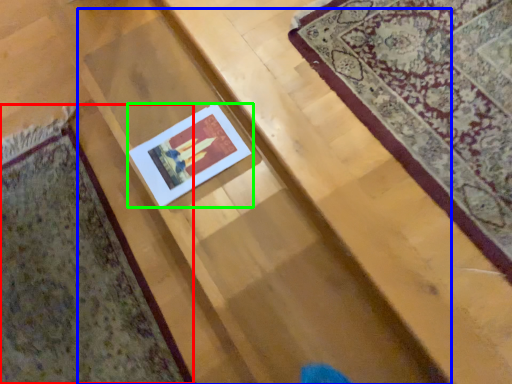
Question: Based on their relative distances, which object is farther from mat (highlighted by a red box)? Choose from stairwell (highlighted by a blue box) and picture frame (highlighted by a green box).

Choices:
 (A) stairwell
 (B) picture frame

Answer: (B)